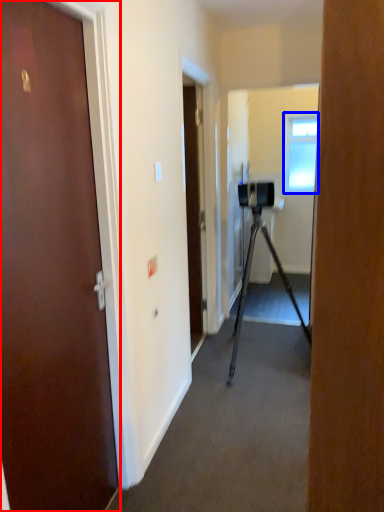
Question: Which of the following is the farthest to the observer, door (highlighted by a red box) or window (highlighted by a blue box)?

Choices:
 (A) door
 (B) window

Answer: (B)